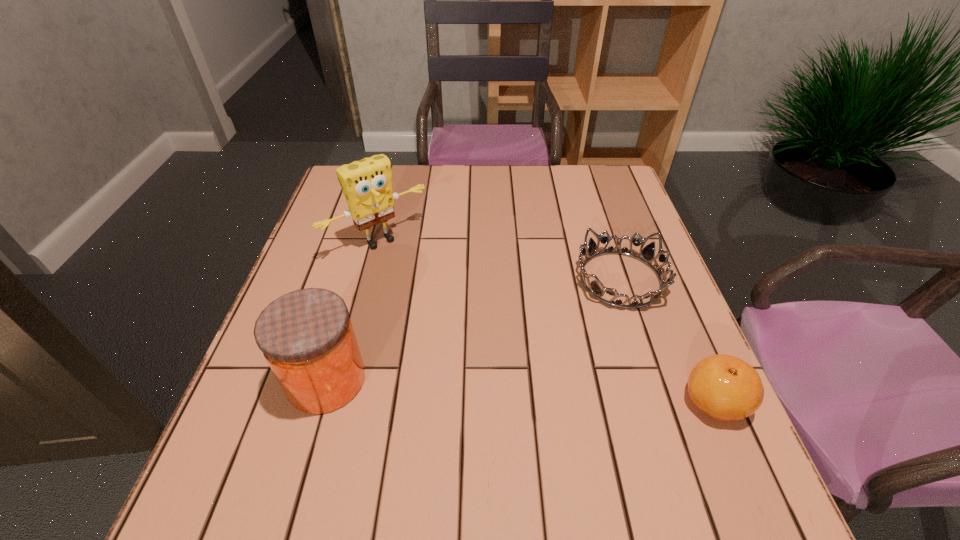
Find the location of a particular element. The height and width of the screenshot is (540, 960). free point located on the face of the sponge is located at coordinates (427, 287).

Identify the location of free location located on the face of the sponge. The image size is (960, 540). (474, 339).

Locate an element on the screen. jar that is at the near edge is located at coordinates (306, 336).

The image size is (960, 540). I want to click on clementine that is positioned at the near edge, so click(726, 388).

I want to click on jar situated at the left edge, so click(306, 336).

Where is `sponge present at the left edge`? This screenshot has width=960, height=540. sponge present at the left edge is located at coordinates (367, 185).

Where is `clementine located in the right edge section of the desktop`? This screenshot has width=960, height=540. clementine located in the right edge section of the desktop is located at coordinates [x=726, y=388].

Where is `tiara positioned at the right edge`? This screenshot has width=960, height=540. tiara positioned at the right edge is located at coordinates (647, 254).

The height and width of the screenshot is (540, 960). In order to click on object at the near left corner in this screenshot , I will do `click(306, 336)`.

Where is `object located in the near right corner section of the desktop`? This screenshot has width=960, height=540. object located in the near right corner section of the desktop is located at coordinates (726, 388).